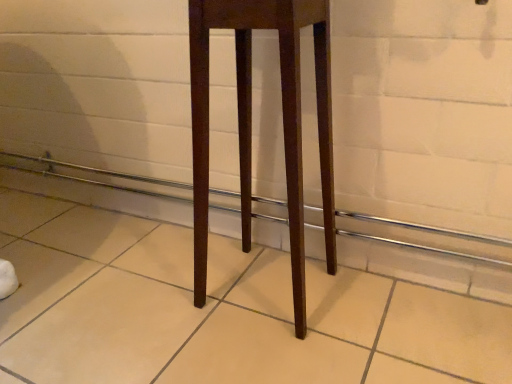
Question: Is point (103, 170) closer or farther from the camera than point (325, 8)?

Choices:
 (A) farther
 (B) closer

Answer: (A)

Question: Is brown wooden balustrade at center spatially inside mahogany wood stool at center, or outside of it?

Choices:
 (A) outside
 (B) inside

Answer: (A)

Question: Based on their sizes in the image, would you say brown wooden balustrade at center is bigger or smaller than mahogany wood stool at center?

Choices:
 (A) big
 (B) small

Answer: (B)

Question: In terms of width, does mahogany wood stool at center look wider or thinner when compared to brown wooden balustrade at center?

Choices:
 (A) wide
 (B) thin

Answer: (A)

Question: Is mahogany wood stool at center in front of or behind brown wooden balustrade at center in the image?

Choices:
 (A) behind
 (B) front

Answer: (B)

Question: Is point (249, 201) positioned closer to the camera than point (95, 172)?

Choices:
 (A) farther
 (B) closer

Answer: (B)

Question: Is mahogany wood stool at center situated inside brown wooden balustrade at center or outside?

Choices:
 (A) outside
 (B) inside

Answer: (A)